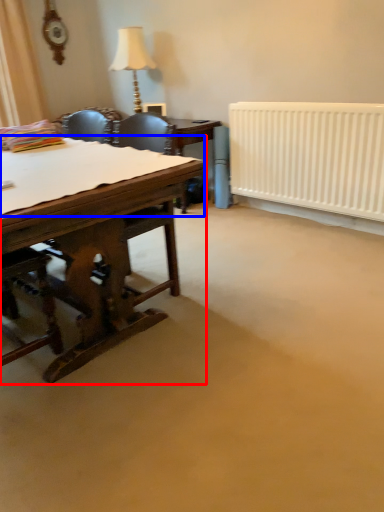
Question: Which of the following is the closest to the observer, desk (highlighted by a red box) or sheet (highlighted by a blue box)?

Choices:
 (A) desk
 (B) sheet

Answer: (A)